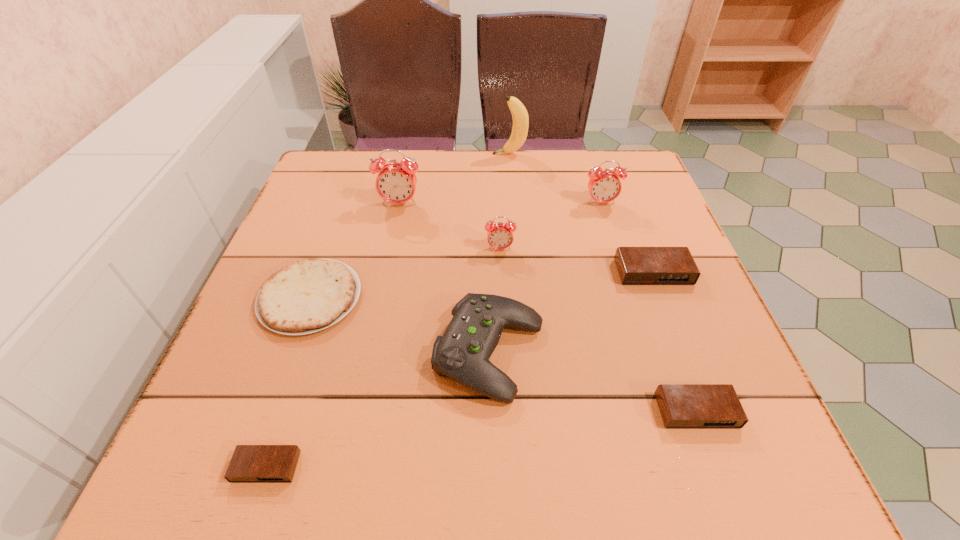
At what (x,y) coordinates should I click in order to perform the action: click on free space located on the face of the third tallest alarm clock. Please return your answer as a coordinate pair (x, y). The height and width of the screenshot is (540, 960). Looking at the image, I should click on (502, 298).

This screenshot has width=960, height=540. What are the coordinates of `vacant space located 0.190m on the back of the control` in the screenshot? It's located at (488, 241).

Identify the location of vacant space situated on the front face of the biggest black alarm clock. (684, 351).

Image resolution: width=960 pixels, height=540 pixels. I want to click on vacant space located 0.160m on the front of the beige tortilla, so click(x=266, y=422).

The width and height of the screenshot is (960, 540). Identify the location of banana located at the far edge. (519, 113).

Locate an element on the screen. The image size is (960, 540). tortilla that is at the left edge is located at coordinates (309, 295).

At what (x,y) coordinates should I click in order to perform the action: click on alarm clock that is positioned at the left edge. Please return your answer as a coordinate pair (x, y). This screenshot has height=540, width=960. Looking at the image, I should click on (250, 463).

Find the location of `object that is at the near left corner`. object that is at the near left corner is located at coordinates (250, 463).

Where is `object positioned at the far right corner`? Image resolution: width=960 pixels, height=540 pixels. object positioned at the far right corner is located at coordinates (604, 186).

The image size is (960, 540). In order to click on object that is positioned at the near right corner in this screenshot , I will do `click(682, 406)`.